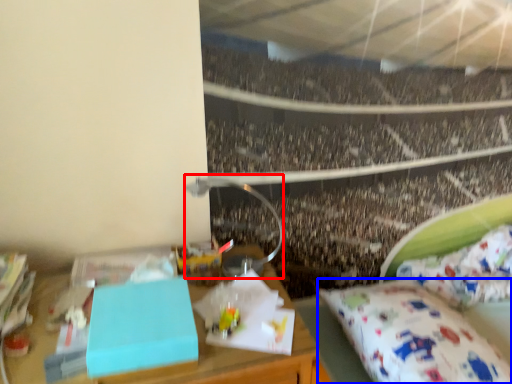
Question: Which of the following is the closest to the observer, lamp (highlighted by a red box) or mattress (highlighted by a blue box)?

Choices:
 (A) lamp
 (B) mattress

Answer: (B)